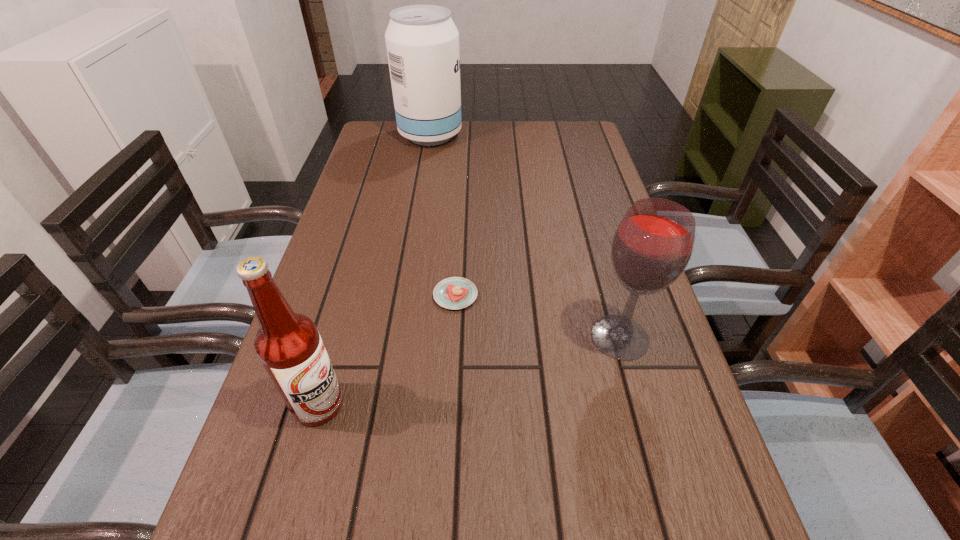
You are a GUI agent. You are given a task and a screenshot of the screen. Output one action in this format:
    pyautogui.click(x=<x>, y=<y>)
    Task: Click on the object that is at the far edge
    This screenshot has height=540, width=960.
    Given the screenshot: What is the action you would take?
    pyautogui.click(x=422, y=41)

Identify the location of object that is positioned at the right edge. (651, 248).

The image size is (960, 540). Identify the location of object positioned at the far left corner. (422, 41).

Identify the location of free point at the far edge. (444, 156).

You are a GUI agent. You are given a task and a screenshot of the screen. Output one action in this format:
    pyautogui.click(x=<x>, y=<y>)
    Task: Click on the free region at the left edge
    The height and width of the screenshot is (540, 960).
    Given the screenshot: What is the action you would take?
    pyautogui.click(x=374, y=162)

This screenshot has width=960, height=540. In order to click on free space at the right edge of the desktop in this screenshot , I will do pos(567,211).

This screenshot has width=960, height=540. I want to click on vacant area that lies between the nearest object and the farthest alcohol, so click(374, 269).

This screenshot has width=960, height=540. I want to click on free space between the nearest alcohol and the rightmost alcohol, so click(x=469, y=370).

Where is `free space between the third farthest object and the second farthest object`? free space between the third farthest object and the second farthest object is located at coordinates (538, 316).

Find the location of a particular element. This screenshot has height=540, width=960. blank region between the rightmost alcohol and the nearest object is located at coordinates click(x=469, y=370).